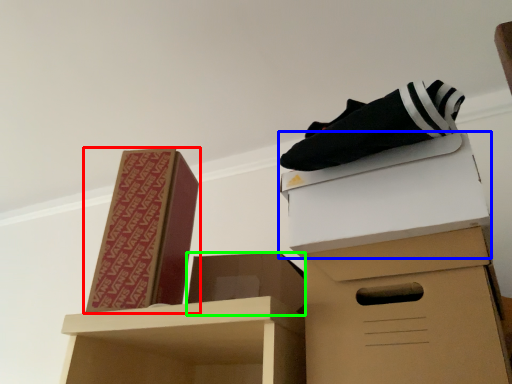
Question: Estimate the real-world distances between objects in this image. Which object is farther from box (highlighted by a red box), box (highlighted by a blue box) or box (highlighted by a green box)?

Choices:
 (A) box
 (B) box

Answer: (A)